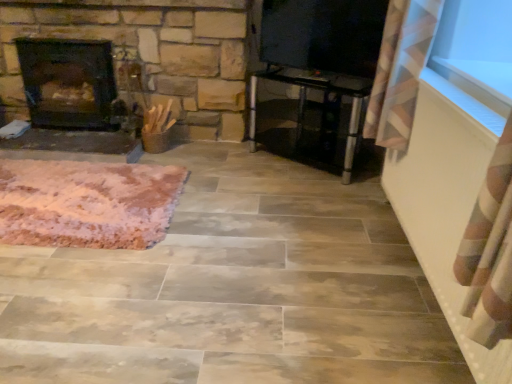
Where is `dark brown stone fireplace at left`? dark brown stone fireplace at left is located at coordinates (68, 82).

Measure the distance between transparent glass table at center and camera.

7.69 feet.

I want to click on pink fluffy rug at lower left, so click(87, 203).

You are a GUI agent. You are given a task and a screenshot of the screen. Output one action in this format:
    pyautogui.click(x=<x>, y=<y>)
    Task: Click on the dark brown stone fireplace at left
    
    Given the screenshot: What is the action you would take?
    pyautogui.click(x=68, y=82)

This screenshot has height=384, width=512. I want to click on mat in front of the transparent glass window screen at upper right, so click(87, 203).

From the image's perspective, relative to transparent glass window screen at upper right, is pink fluffy rug at lower left above or below?

Clearly, from the image's perspective, pink fluffy rug at lower left is below transparent glass window screen at upper right.

Is pink fluffy rug at lower left positioned far away from transparent glass window screen at upper right?

Yes, pink fluffy rug at lower left is far from transparent glass window screen at upper right.

Considering the relative positions of pink fluffy rug at lower left and transparent glass window screen at upper right in the image provided, is pink fluffy rug at lower left to the left of transparent glass window screen at upper right from the viewer's perspective?

Correct, you'll find pink fluffy rug at lower left to the left of transparent glass window screen at upper right.

Is the position of pink fluffy rug at lower left more distant than that of transparent glass table at center?

No, it is not.

Can you tell me how much pink fluffy rug at lower left and transparent glass table at center differ in facing direction?

The angular difference between pink fluffy rug at lower left and transparent glass table at center is 36.5 degrees.

Looking at this image, from a real-world perspective, which object stands above the other?

In real-world perspective, transparent glass table at center is above.

Which object is thinner, pink fluffy rug at lower left or transparent glass table at center?

With smaller width is transparent glass table at center.

Which point is more forward, (331,33) or (109,78)?

The point (331,33) is closer to the camera.

Could dark brown stone fireplace at left be considered to be inside transparent glass window screen at upper right?

Actually, dark brown stone fireplace at left is outside transparent glass window screen at upper right.

The height and width of the screenshot is (384, 512). Identify the location of window screen above the dark brown stone fireplace at left (from the image's perspective). (323, 35).

Which of these two, dark brown stone fireplace at left or transparent glass window screen at upper right, is bigger?

dark brown stone fireplace at left.

Based on the photo, which is behind, dark brown stone fireplace at left or transparent glass window screen at upper right?

dark brown stone fireplace at left.

This screenshot has height=384, width=512. Identify the location of fireplace located behind the transparent glass window screen at upper right. (68, 82).

Looking at this image, from the image's perspective, between dark brown stone fireplace at left and transparent glass window screen at upper right, which one is located above?

transparent glass window screen at upper right, from the image's perspective.

Between pink fluffy rug at lower left and dark brown stone fireplace at left, which one has larger size?

Bigger between the two is dark brown stone fireplace at left.

Is pink fluffy rug at lower left closer to the viewer compared to dark brown stone fireplace at left?

Yes, pink fluffy rug at lower left is closer to the camera.

Is dark brown stone fireplace at left at the back of pink fluffy rug at lower left?

pink fluffy rug at lower left does not have its back to dark brown stone fireplace at left.

What's the angular difference between pink fluffy rug at lower left and dark brown stone fireplace at left's facing directions?

There is a 2.32-degree angle between the facing directions of pink fluffy rug at lower left and dark brown stone fireplace at left.

Is dark brown stone fireplace at left aimed at transparent glass table at center?

No.

Is dark brown stone fireplace at left in front of or behind transparent glass table at center in the image?

Clearly, dark brown stone fireplace at left is behind transparent glass table at center.

Which point is more forward, (80, 111) or (360, 111)?

The point (360, 111) is closer to the camera.

Are dark brown stone fireplace at left and transparent glass table at center far apart?

Yes, dark brown stone fireplace at left is far from transparent glass table at center.

Is transparent glass window screen at upper right looking in the opposite direction of pink fluffy rug at lower left?

No, pink fluffy rug at lower left is not at the back of transparent glass window screen at upper right.

Who is taller, transparent glass window screen at upper right or pink fluffy rug at lower left?

transparent glass window screen at upper right is taller.

Is point (282, 42) farther from viewer compared to point (18, 187)?

That is True.

Looking at this image, is transparent glass window screen at upper right not close to pink fluffy rug at lower left?

Absolutely, transparent glass window screen at upper right is distant from pink fluffy rug at lower left.

This screenshot has width=512, height=384. In order to click on mat on the left of transparent glass window screen at upper right in this screenshot , I will do `click(87, 203)`.

This screenshot has width=512, height=384. I want to click on furniture that is on the right side of pink fluffy rug at lower left, so click(304, 105).

Considering their positions, is pink fluffy rug at lower left positioned closer to transparent glass window screen at upper right than dark brown stone fireplace at left?

pink fluffy rug at lower left.

When comparing their distances from dark brown stone fireplace at left, does transparent glass table at center or transparent glass window screen at upper right seem further?

transparent glass window screen at upper right lies further to dark brown stone fireplace at left than the other object.

Consider the image. When comparing their distances from transparent glass table at center, does transparent glass window screen at upper right or pink fluffy rug at lower left seem closer?

transparent glass window screen at upper right lies closer to transparent glass table at center than the other object.

Based on their spatial positions, is dark brown stone fireplace at left or transparent glass window screen at upper right further from transparent glass table at center?

The object further to transparent glass table at center is dark brown stone fireplace at left.

From the image, which object appears to be nearer to transparent glass window screen at upper right, transparent glass table at center or dark brown stone fireplace at left?

transparent glass table at center.

When comparing their distances from pink fluffy rug at lower left, does dark brown stone fireplace at left or transparent glass table at center seem further?

transparent glass table at center is further to pink fluffy rug at lower left.

Based on the photo, estimate the real-world distances between objects in this image. Which object is closer to dark brown stone fireplace at left, transparent glass window screen at upper right or pink fluffy rug at lower left?

Among the two, pink fluffy rug at lower left is located nearer to dark brown stone fireplace at left.

From the image, which object appears to be farther from transparent glass table at center, pink fluffy rug at lower left or dark brown stone fireplace at left?

dark brown stone fireplace at left.

You are a GUI agent. You are given a task and a screenshot of the screen. Output one action in this format:
    pyautogui.click(x=<x>, y=<y>)
    Task: Click on the furniture located between dark brown stone fireplace at left and transparent glass window screen at upper right in the left-right direction
    
    Given the screenshot: What is the action you would take?
    pyautogui.click(x=304, y=105)

Where is `mat between dark brown stone fireplace at left and transparent glass table at center`? This screenshot has height=384, width=512. mat between dark brown stone fireplace at left and transparent glass table at center is located at coordinates (87, 203).

Image resolution: width=512 pixels, height=384 pixels. I want to click on furniture between pink fluffy rug at lower left and transparent glass window screen at upper right, so pos(304,105).

Where is `mat between dark brown stone fireplace at left and transparent glass window screen at upper right in the horizontal direction`? mat between dark brown stone fireplace at left and transparent glass window screen at upper right in the horizontal direction is located at coordinates (87, 203).